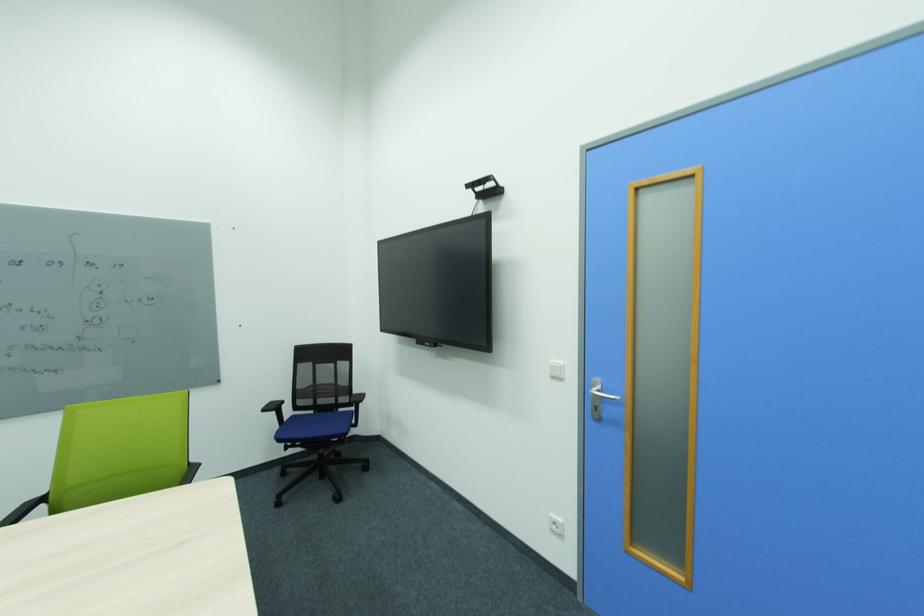
Where is `blue chair sitting surface`? blue chair sitting surface is located at coordinates (314, 426).